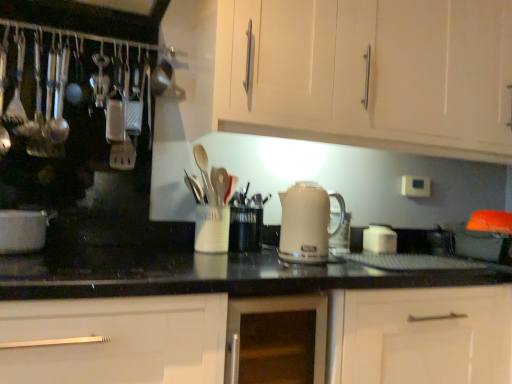
This screenshot has height=384, width=512. In order to click on beige glossy kettle at center in this screenshot , I will do `click(307, 223)`.

What do you see at coordinates (212, 229) in the screenshot? Image resolution: width=512 pixels, height=384 pixels. I see `white matte cup at center` at bounding box center [212, 229].

Find the location of a particular element. white glossy cabinet at center, the 1th cabinetry positioned from the bottom is located at coordinates (120, 340).

From a real-world perspective, is white matte cabinet at upper center, arranged as the 1th cabinetry when viewed from the top, above or below white glossy pot at left?

white matte cabinet at upper center, arranged as the 1th cabinetry when viewed from the top, is situated higher than white glossy pot at left in the real world.

Considering the relative sizes of white matte cabinet at upper center, arranged as the 1th cabinetry when viewed from the top, and white glossy pot at left in the image provided, is white matte cabinet at upper center, arranged as the 1th cabinetry when viewed from the top, smaller than white glossy pot at left?

No, white matte cabinet at upper center, arranged as the 1th cabinetry when viewed from the top, is not smaller than white glossy pot at left.

Choose the correct answer: Is white matte cabinet at upper center, arranged as the 2th cabinetry when ordered from the bottom, inside white glossy pot at left or outside it?

white matte cabinet at upper center, arranged as the 2th cabinetry when ordered from the bottom, is not enclosed by white glossy pot at left.

Considering the sizes of black glass gas stove at lower left and beige glossy kettle at center in the image, is black glass gas stove at lower left taller or shorter than beige glossy kettle at center?

In the image, black glass gas stove at lower left appears to be shorter than beige glossy kettle at center.

The width and height of the screenshot is (512, 384). In order to click on gas stove below the beige glossy kettle at center (from a real-world perspective) in this screenshot , I will do `click(87, 266)`.

From a real-world perspective, is black glass gas stove at lower left on top of beige glossy kettle at center?

No.

Is white glossy cabinet at center, the 1th cabinetry positioned from the bottom, surrounded by white matte cup at center?

No, white glossy cabinet at center, the 1th cabinetry positioned from the bottom, is not surrounded by white matte cup at center.

From a real-world perspective, which is physically below, white matte cup at center or white glossy cabinet at center, which appears as the second cabinetry when viewed from the top?

From a 3D spatial view, white glossy cabinet at center, which appears as the second cabinetry when viewed from the top, is below.

Looking at this image, is white matte cup at center positioned before white glossy cabinet at center, which appears as the second cabinetry when viewed from the top?

No, the depth of white matte cup at center is greater than that of white glossy cabinet at center, which appears as the second cabinetry when viewed from the top.

Can you tell me how much white matte cup at center and white glossy cabinet at center, which appears as the second cabinetry when viewed from the top, differ in facing direction?

1.62 degrees separate the facing orientations of white matte cup at center and white glossy cabinet at center, which appears as the second cabinetry when viewed from the top.

From a real-world perspective, is black glass gas stove at lower left below white glossy pot at left?

Yes, from a real-world perspective, black glass gas stove at lower left is beneath white glossy pot at left.

In the scene shown: Can you confirm if black glass gas stove at lower left is shorter than white glossy pot at left?

Yes.

Is the position of black glass gas stove at lower left less distant than that of white glossy pot at left?

Yes.

Which object is further away from the camera, beige glossy kettle at center or white glossy cabinet at center, the 1th cabinetry positioned from the bottom?

beige glossy kettle at center is more distant.

Where is `kitchen appliance behind the white glossy cabinet at center, which appears as the second cabinetry when viewed from the top`? kitchen appliance behind the white glossy cabinet at center, which appears as the second cabinetry when viewed from the top is located at coordinates (307, 223).

Based on their positions, is beige glossy kettle at center located to the left or right of white glossy cabinet at center, the 1th cabinetry positioned from the bottom?

beige glossy kettle at center is to the right of white glossy cabinet at center, the 1th cabinetry positioned from the bottom.

Does beige glossy kettle at center have a greater height compared to white glossy cabinet at center, which appears as the second cabinetry when viewed from the top?

No.

From a real-world perspective, is black glass gas stove at lower left physically located above or below white plastic electric outlet at upper right?

From a real-world perspective, black glass gas stove at lower left is physically below white plastic electric outlet at upper right.

Considering the positions of point (105, 282) and point (423, 189), is point (105, 282) closer or farther from the camera than point (423, 189)?

Point (105, 282) is positioned closer to the camera compared to point (423, 189).

Considering the sizes of objects black glass gas stove at lower left and white plastic electric outlet at upper right in the image provided, who is shorter, black glass gas stove at lower left or white plastic electric outlet at upper right?

Standing shorter between the two is black glass gas stove at lower left.

Could you tell me if black glass gas stove at lower left is turned towards white plastic electric outlet at upper right?

No, black glass gas stove at lower left does not turn towards white plastic electric outlet at upper right.

In the scene shown: Considering the positions of objects white glossy pot at left and white glossy cabinet at center, the 1th cabinetry positioned from the bottom, in the image provided, who is more to the right, white glossy pot at left or white glossy cabinet at center, the 1th cabinetry positioned from the bottom,?

white glossy cabinet at center, the 1th cabinetry positioned from the bottom.

From the image's perspective, between white glossy pot at left and white glossy cabinet at center, the 1th cabinetry positioned from the bottom, which one is located above?

white glossy pot at left appears higher in the image.

Could you tell me if white glossy pot at left is turned towards white glossy cabinet at center, the 1th cabinetry positioned from the bottom?

No, white glossy pot at left is not facing towards white glossy cabinet at center, the 1th cabinetry positioned from the bottom.

From their relative heights in the image, would you say white glossy pot at left is taller or shorter than white glossy cabinet at center, which appears as the second cabinetry when viewed from the top?

Clearly, white glossy pot at left is shorter compared to white glossy cabinet at center, which appears as the second cabinetry when viewed from the top.

Locate an element on the screen. The width and height of the screenshot is (512, 384). home appliance lying below the white matte cabinet at upper center, arranged as the 2th cabinetry when ordered from the bottom (from the image's perspective) is located at coordinates (23, 230).

I want to click on kitchen appliance that appears behind the black glass gas stove at lower left, so click(307, 223).

Estimate the real-world distances between objects in this image. Which object is closer to white glossy cabinet at center, the 1th cabinetry positioned from the bottom, white plastic electric outlet at upper right or white matte cup at center?

Based on the image, white matte cup at center appears to be nearer to white glossy cabinet at center, the 1th cabinetry positioned from the bottom.

Based on their spatial positions, is black glass gas stove at lower left or white matte cup at center closer to white glossy cabinet at center, which appears as the second cabinetry when viewed from the top?

white matte cup at center.

Which object lies further to the anchor point white matte cup at center, white glossy cabinet at center, the 1th cabinetry positioned from the bottom, or white matte cabinet at upper center, arranged as the 1th cabinetry when viewed from the top?

Among the two, white matte cabinet at upper center, arranged as the 1th cabinetry when viewed from the top, is located further to white matte cup at center.

Which object lies further to the anchor point beige glossy kettle at center, white glossy pot at left or white plastic electric outlet at upper right?

white glossy pot at left is positioned further to the anchor beige glossy kettle at center.

From the image, which object appears to be farther from beige glossy kettle at center, white matte cup at center or white matte cabinet at upper center, arranged as the 2th cabinetry when ordered from the bottom?

white matte cabinet at upper center, arranged as the 2th cabinetry when ordered from the bottom, is further to beige glossy kettle at center.

In the scene shown: Based on their spatial positions, is beige glossy kettle at center or white matte cup at center closer to white plastic electric outlet at upper right?

Among the two, beige glossy kettle at center is located nearer to white plastic electric outlet at upper right.

Estimate the real-world distances between objects in this image. Which object is further from black glass gas stove at lower left, white glossy pot at left or white plastic electric outlet at upper right?

Among the two, white plastic electric outlet at upper right is located further to black glass gas stove at lower left.

Looking at the image, which one is located further to white matte cabinet at upper center, arranged as the 1th cabinetry when viewed from the top, white matte cup at center or beige glossy kettle at center?

Based on the image, white matte cup at center appears to be further to white matte cabinet at upper center, arranged as the 1th cabinetry when viewed from the top.

At what (x,y) coordinates should I click in order to perform the action: click on tableware between white matte cabinet at upper center, arranged as the 1th cabinetry when viewed from the top, and white glossy cabinet at center, which appears as the second cabinetry when viewed from the top, from top to bottom. Please return your answer as a coordinate pair (x, y). The image size is (512, 384). Looking at the image, I should click on (212, 229).

Find the location of `tableware located between white glossy cabinet at center, the 1th cabinetry positioned from the bottom, and white plastic electric outlet at upper right in the depth direction`. tableware located between white glossy cabinet at center, the 1th cabinetry positioned from the bottom, and white plastic electric outlet at upper right in the depth direction is located at coordinates (212, 229).

This screenshot has height=384, width=512. Identify the location of tableware between white glossy pot at left and white glossy cabinet at center, which appears as the second cabinetry when viewed from the top. (212, 229).

Identify the location of tableware between white glossy pot at left and white plastic electric outlet at upper right. (212, 229).